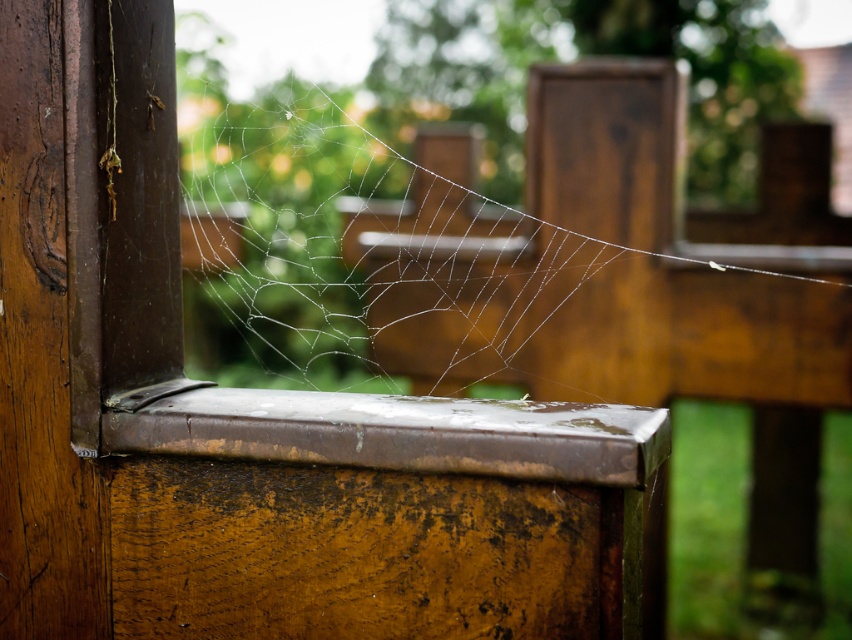
Who is positioned more to the left, transparent glass window at left or rusty metal window sill at center?

transparent glass window at left is more to the left.

Who is taller, transparent glass window at left or rusty metal window sill at center?

Standing taller between the two is transparent glass window at left.

Who is more distant from viewer, (x=579, y=419) or (x=665, y=413)?

Point (x=665, y=413)

Where is `transparent glass window at left`? This screenshot has width=852, height=640. transparent glass window at left is located at coordinates (265, 388).

Based on the photo, does transparent silk spider web at center have a smaller size compared to transparent glass window at left?

Incorrect, transparent silk spider web at center is not smaller in size than transparent glass window at left.

Describe the element at coordinates (567, 260) in the screenshot. I see `transparent silk spider web at center` at that location.

This screenshot has height=640, width=852. What are the coordinates of `transparent silk spider web at center` in the screenshot? It's located at (567, 260).

Is transparent silk spider web at center above rusty metal window sill at center?

Yes, transparent silk spider web at center is above rusty metal window sill at center.

Is transparent silk spider web at center to the right of rusty metal window sill at center from the viewer's perspective?

Indeed, transparent silk spider web at center is positioned on the right side of rusty metal window sill at center.

Identify the location of transparent silk spider web at center. The width and height of the screenshot is (852, 640). (567, 260).